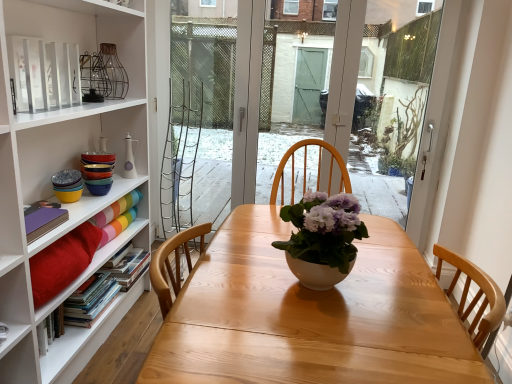
The image size is (512, 384). What do you see at coordinates (116, 209) in the screenshot? I see `matte rainbow paper at left, which ranks as the 4th book in bottom-to-top order` at bounding box center [116, 209].

What do you see at coordinates (129, 159) in the screenshot? This screenshot has height=384, width=512. I see `matte white vase at upper left` at bounding box center [129, 159].

Where is `white matte vase at center`? This screenshot has height=384, width=512. white matte vase at center is located at coordinates (322, 238).

Describe the element at coordinates (322, 238) in the screenshot. I see `white matte vase at center` at that location.

In the scene shown: What is the approximate height of wooden table at center?

wooden table at center is 20.61 inches tall.

Find the location of a particular element. The height and width of the screenshot is (384, 512). wooden table at center is located at coordinates (310, 316).

This screenshot has height=384, width=512. Identify the location of hardcover book at left, acting as the fourth book starting from the top. (91, 301).

Looking at this image, measure the distance between purple matte book at left, the third book ordered from the bottom, and camera.

They are 4.60 feet apart.

What do you see at coordinates (130, 267) in the screenshot? The image size is (512, 384). I see `hardcover books at left, arranged as the 3th book when viewed from the top` at bounding box center [130, 267].

Based on the photo, in order to face hardcover books at left, arranged as the 3th book when viewed from the top, should I rotate leftwards or rightwards?

You should rotate left by 17.199 degrees.

This screenshot has width=512, height=384. What are the coordinates of `matte rainbow paper at left, which ranks as the 4th book in bottom-to-top order` in the screenshot? It's located at (116, 209).

Looking at this image, from the image's perspective, which is above, wooden table at center or matte white vase at upper left?

matte white vase at upper left is shown above in the image.

Does wooden table at center come in front of matte white vase at upper left?

Yes, wooden table at center is closer to the camera.

Can you confirm if wooden table at center is thinner than matte white vase at upper left?

No, wooden table at center is not thinner than matte white vase at upper left.

Between wooden table at center and matte white vase at upper left, which one appears on the right side from the viewer's perspective?

From the viewer's perspective, wooden table at center appears more on the right side.

From the image's perspective, does hardcover book at left, acting as the 1th book starting from the bottom, appear lower than purple matte book at left, the third book ordered from the bottom?

Yes.

Considering the relative sizes of hardcover book at left, acting as the fourth book starting from the top, and purple matte book at left, the second book positioned from the top, in the image provided, is hardcover book at left, acting as the fourth book starting from the top, taller than purple matte book at left, the second book positioned from the top,?

Yes.

Would you say hardcover book at left, acting as the fourth book starting from the top, is outside purple matte book at left, the third book ordered from the bottom?

Yes, hardcover book at left, acting as the fourth book starting from the top, is not within purple matte book at left, the third book ordered from the bottom.

Can we say hardcover books at left, the 2th book ordered from the bottom, lies outside purple matte book at left, the second book positioned from the top?

Yes.

Is the surface of hardcover books at left, the 2th book ordered from the bottom, in direct contact with purple matte book at left, the third book ordered from the bottom?

No, hardcover books at left, the 2th book ordered from the bottom, is not in contact with purple matte book at left, the third book ordered from the bottom.

From a real-world perspective, is hardcover books at left, arranged as the 3th book when viewed from the top, over purple matte book at left, the third book ordered from the bottom?

No, from a real-world perspective, hardcover books at left, arranged as the 3th book when viewed from the top, is not above purple matte book at left, the third book ordered from the bottom.

How distant is hardcover book at left, acting as the 1th book starting from the bottom, from matte white vase at upper left?

hardcover book at left, acting as the 1th book starting from the bottom, is 24.82 inches away from matte white vase at upper left.

What's the angular difference between hardcover book at left, acting as the 1th book starting from the bottom, and matte white vase at upper left's facing directions?

1.28 degrees separate the facing orientations of hardcover book at left, acting as the 1th book starting from the bottom, and matte white vase at upper left.

Can you confirm if hardcover book at left, acting as the 1th book starting from the bottom, is wider than matte white vase at upper left?

Yes.

From the image's perspective, is hardcover book at left, acting as the 1th book starting from the bottom, located above or below matte white vase at upper left?

hardcover book at left, acting as the 1th book starting from the bottom, is situated lower than matte white vase at upper left in the image.

Is hardcover book at left, acting as the fourth book starting from the top, at the back of purple matte book at left, the third book ordered from the bottom?

No, purple matte book at left, the third book ordered from the bottom, is not facing away from hardcover book at left, acting as the fourth book starting from the top.

Considering the sizes of objects purple matte book at left, the third book ordered from the bottom, and hardcover book at left, acting as the fourth book starting from the top, in the image provided, who is wider, purple matte book at left, the third book ordered from the bottom, or hardcover book at left, acting as the fourth book starting from the top,?

hardcover book at left, acting as the fourth book starting from the top, is wider.

Does purple matte book at left, the third book ordered from the bottom, appear on the right side of hardcover book at left, acting as the fourth book starting from the top?

No, purple matte book at left, the third book ordered from the bottom, is not to the right of hardcover book at left, acting as the fourth book starting from the top.

How different are the orientations of hardcover books at left, arranged as the 3th book when viewed from the top, and matte rainbow paper at left, which ranks as the 4th book in bottom-to-top order, in degrees?

4.01 degrees separate the facing orientations of hardcover books at left, arranged as the 3th book when viewed from the top, and matte rainbow paper at left, which ranks as the 4th book in bottom-to-top order.

Is hardcover books at left, arranged as the 3th book when viewed from the top, inside or outside of matte rainbow paper at left, the first book from the top?

hardcover books at left, arranged as the 3th book when viewed from the top, exists outside the volume of matte rainbow paper at left, the first book from the top.

Is hardcover books at left, arranged as the 3th book when viewed from the top, smaller than matte rainbow paper at left, which ranks as the 4th book in bottom-to-top order?

No, hardcover books at left, arranged as the 3th book when viewed from the top, is not smaller than matte rainbow paper at left, which ranks as the 4th book in bottom-to-top order.

Is hardcover books at left, arranged as the 3th book when viewed from the top, far from matte rainbow paper at left, which ranks as the 4th book in bottom-to-top order?

hardcover books at left, arranged as the 3th book when viewed from the top, is near matte rainbow paper at left, which ranks as the 4th book in bottom-to-top order, not far away.

Can you confirm if purple matte book at left, the second book positioned from the top, is positioned to the left of matte white vase at upper left?

Yes.

In the scene shown: Could you tell me if purple matte book at left, the second book positioned from the top, is facing matte white vase at upper left?

No, purple matte book at left, the second book positioned from the top, is not oriented towards matte white vase at upper left.

Considering the positions of points (59, 215) and (126, 173), is point (59, 215) farther from camera compared to point (126, 173)?

That is False.

Considering the relative sizes of purple matte book at left, the third book ordered from the bottom, and matte white vase at upper left in the image provided, is purple matte book at left, the third book ordered from the bottom, taller than matte white vase at upper left?

No.

Identify the location of vase above the wooden table at center (from a real-world perspective). The height and width of the screenshot is (384, 512). (129, 159).

I want to click on book that is in front of the hardcover book at left, acting as the fourth book starting from the top, so click(x=42, y=219).

From the image, which object appears to be nearer to hardcover books at left, the 2th book ordered from the bottom, matte white vase at upper left or wooden table at center?

The object closer to hardcover books at left, the 2th book ordered from the bottom, is matte white vase at upper left.

When comparing their distances from hardcover books at left, arranged as the 3th book when viewed from the top, does hardcover book at left, acting as the 1th book starting from the bottom, or matte white vase at upper left seem closer?

Based on the image, hardcover book at left, acting as the 1th book starting from the bottom, appears to be nearer to hardcover books at left, arranged as the 3th book when viewed from the top.

Based on their spatial positions, is purple matte book at left, the second book positioned from the top, or hardcover book at left, acting as the fourth book starting from the top, further from hardcover books at left, the 2th book ordered from the bottom?

purple matte book at left, the second book positioned from the top, is positioned further to the anchor hardcover books at left, the 2th book ordered from the bottom.

Which object lies nearer to the anchor point matte white vase at upper left, matte rainbow paper at left, which ranks as the 4th book in bottom-to-top order, or wooden table at center?

matte rainbow paper at left, which ranks as the 4th book in bottom-to-top order, is positioned closer to the anchor matte white vase at upper left.

Which object lies nearer to the anchor point white matte vase at center, matte white vase at upper left or matte rainbow paper at left, which ranks as the 4th book in bottom-to-top order?

The object closer to white matte vase at center is matte rainbow paper at left, which ranks as the 4th book in bottom-to-top order.

From the image, which object appears to be nearer to wooden table at center, hardcover books at left, arranged as the 3th book when viewed from the top, or purple matte book at left, the second book positioned from the top?

purple matte book at left, the second book positioned from the top, is closer to wooden table at center.

When comparing their distances from purple matte book at left, the second book positioned from the top, does matte rainbow paper at left, the first book from the top, or wooden table at center seem further?

wooden table at center is further to purple matte book at left, the second book positioned from the top.

When comparing their distances from purple matte book at left, the second book positioned from the top, does matte rainbow paper at left, the first book from the top, or hardcover books at left, arranged as the 3th book when viewed from the top, seem further?

The object further to purple matte book at left, the second book positioned from the top, is hardcover books at left, arranged as the 3th book when viewed from the top.

This screenshot has width=512, height=384. I want to click on houseplant positioned between wooden table at center and hardcover books at left, arranged as the 3th book when viewed from the top, from near to far, so click(x=322, y=238).

Find the location of a particular element. book located between purple matte book at left, the second book positioned from the top, and matte rainbow paper at left, the first book from the top, in the depth direction is located at coordinates (91, 301).

You are a GUI agent. You are given a task and a screenshot of the screen. Output one action in this format:
    pyautogui.click(x=<x>, y=<y>)
    Task: Click on the houseplant positioned between wooden table at center and matte white vase at upper left from near to far
    
    Given the screenshot: What is the action you would take?
    pyautogui.click(x=322, y=238)

Identify the location of houseplant between wooden table at center and matte rainbow paper at left, the first book from the top, from front to back. (322, 238).